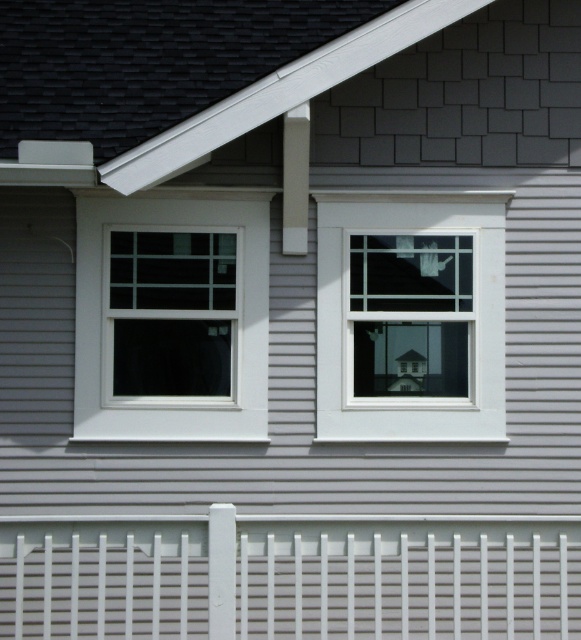
Question: Can you confirm if white plastic fence at lower center is bigger than white glass window at center?

Choices:
 (A) no
 (B) yes

Answer: (B)

Question: Can you confirm if white plastic fence at lower center is positioned to the left of white matte window at left?

Choices:
 (A) yes
 (B) no

Answer: (B)

Question: Where is white glass window at center located in relation to white matte window at left in the image?

Choices:
 (A) left
 (B) right

Answer: (B)

Question: Which point is farther to the camera?

Choices:
 (A) white plastic fence at lower center
 (B) white glass window at center

Answer: (B)

Question: Estimate the real-world distances between objects in this image. Which object is farther from the white plastic fence at lower center?

Choices:
 (A) white glass window at center
 (B) white matte window at left

Answer: (A)

Question: Which point is closer to the camera?

Choices:
 (A) white plastic fence at lower center
 (B) white matte window at left
 (C) white glass window at center

Answer: (A)